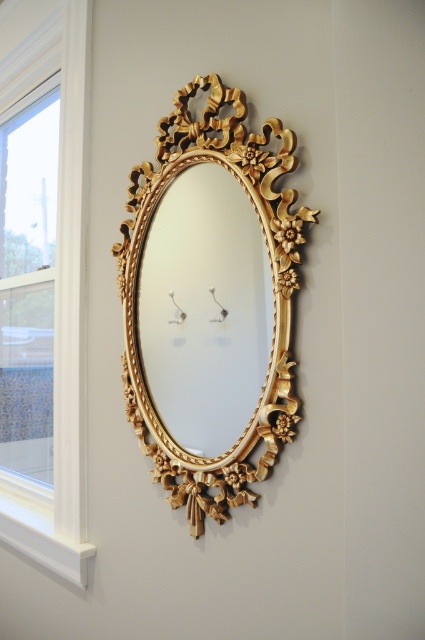
Is gold ornate mirror at upper center behind gold ornate mirror at center?

Yes, it is.

Can you confirm if gold ornate mirror at upper center is positioned below gold ornate mirror at center?

Correct, gold ornate mirror at upper center is located below gold ornate mirror at center.

What do you see at coordinates (204, 308) in the screenshot? I see `gold ornate mirror at upper center` at bounding box center [204, 308].

You are a GUI agent. You are given a task and a screenshot of the screen. Output one action in this format:
    pyautogui.click(x=<x>, y=<y>)
    Task: Click on the gold ornate mirror at upper center
    This screenshot has height=640, width=425.
    Given the screenshot: What is the action you would take?
    pyautogui.click(x=204, y=308)

Does gold ornate mirror at center have a greater width compared to white wood window at left?

In fact, gold ornate mirror at center might be narrower than white wood window at left.

In the scene shown: Measure the distance between point (286, 253) and camera.

The distance of point (286, 253) from camera is 1.04 meters.

The width and height of the screenshot is (425, 640). I want to click on gold ornate mirror at center, so click(x=272, y=288).

Between gold ornate mirror at upper center and white wood window at left, which one appears on the left side from the viewer's perspective?

From the viewer's perspective, white wood window at left appears more on the left side.

Is gold ornate mirror at upper center positioned at the back of white wood window at left?

That is False.

Between point (170, 333) and point (70, 428), which one is positioned in front?

Positioned in front is point (170, 333).

The height and width of the screenshot is (640, 425). Identify the location of gold ornate mirror at upper center. (204, 308).